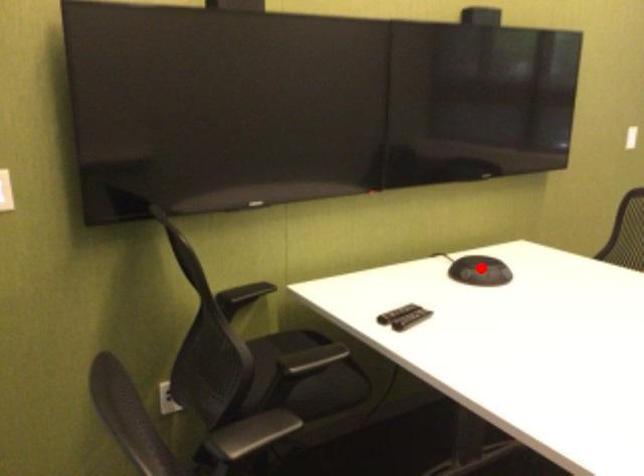
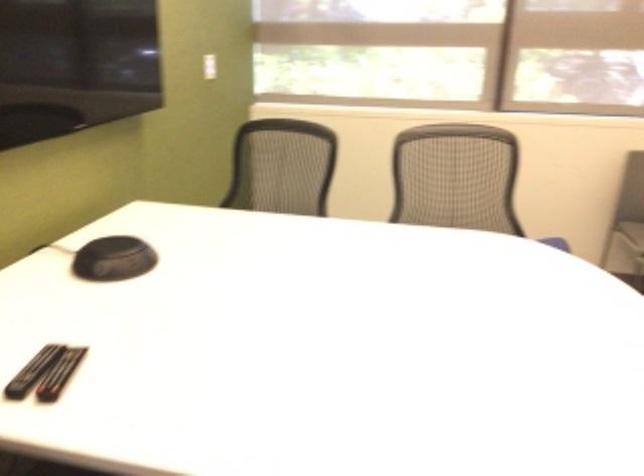
Question: A red point is marked in image1. In image2, is the corresponding 3D point closer to the camera or farther? Reply with the corresponding letter.

Choices:
 (A) The corresponding 3D point is closer.
 (B) The corresponding 3D point is farther.

Answer: (A)